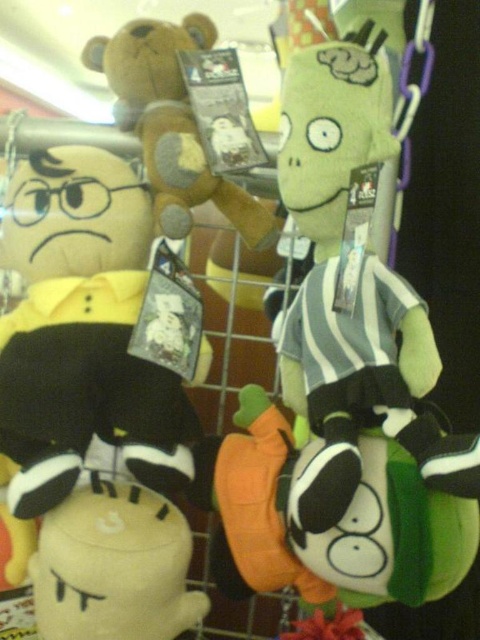
Does black plush toy at left appear on the left side of white plush toy at lower left?

Correct, you'll find black plush toy at left to the left of white plush toy at lower left.

Is point (69, 296) positioned behind point (69, 570)?

Yes, point (69, 296) is behind point (69, 570).

Where is `black plush toy at left`? The height and width of the screenshot is (640, 480). black plush toy at left is located at coordinates (87, 333).

Is point (35, 220) farther from viewer compared to point (171, 134)?

That is False.

Can you confirm if black plush toy at left is positioned below brown plush bear at upper center?

Yes.

Locate an element on the screen. black plush toy at left is located at coordinates (87, 333).

Does white plush toy at lower left come behind brown plush bear at upper center?

No, it is not.

Describe the element at coordinates (115, 566) in the screenshot. The width and height of the screenshot is (480, 640). I see `white plush toy at lower left` at that location.

I want to click on white plush toy at lower left, so click(x=115, y=566).